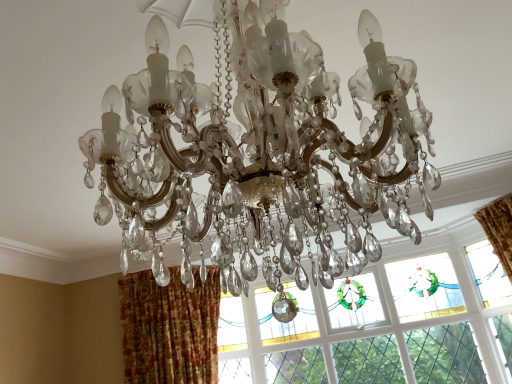
Question: Is clear crystal chandelier at center spatially inside stained glass window at center, or outside of it?

Choices:
 (A) inside
 (B) outside

Answer: (B)

Question: Is clear crystal chandelier at center wider or thinner than stained glass window at center?

Choices:
 (A) thin
 (B) wide

Answer: (B)

Question: Which is nearer to the stained glass window at center?

Choices:
 (A) textured orange curtain at lower left
 (B) clear crystal chandelier at center

Answer: (A)

Question: Estimate the real-world distances between objects in this image. Which object is farther from the stained glass window at center?

Choices:
 (A) clear crystal chandelier at center
 (B) textured orange curtain at lower left

Answer: (A)